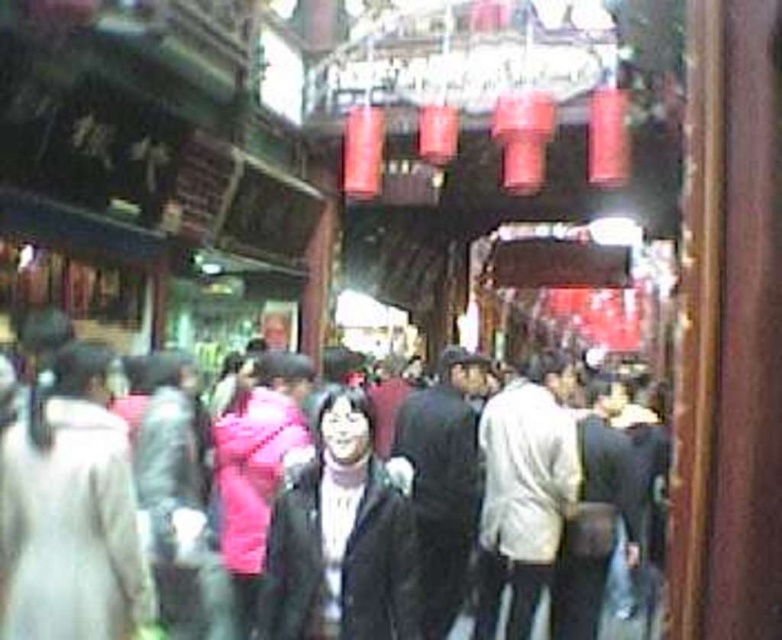
Looking at this image, you are a customer in this market and want to buy a jacket. You see both the black matte jacket at center and the dark gray jacket at center. Which jacket is positioned to the left?

The black matte jacket at center is positioned to the left of the dark gray jacket at center.

You are standing at the entrance of the market and want to find the black matte jacket at center. According to the coordinates provided, in which direction should you walk to reach it?

The black matte jacket at center is located at coordinates point (339, 540). Since the x coordinate is 0.845, which is closer to the right edge of the image, and the y coordinate is 0.436, closer to the bottom, you should walk towards the lower right direction to reach it.